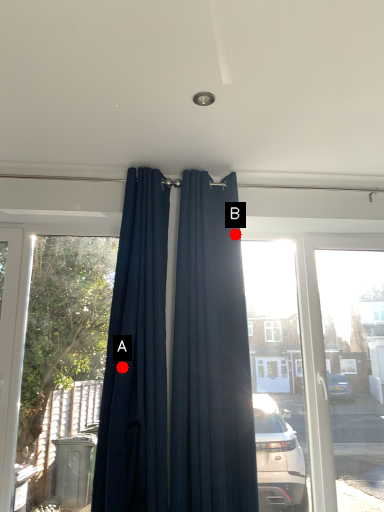
Question: Two points are circled on the image, labeled by A and B beside each circle. Which point is closer to the camera taking this photo?

Choices:
 (A) A is closer
 (B) B is closer

Answer: (A)